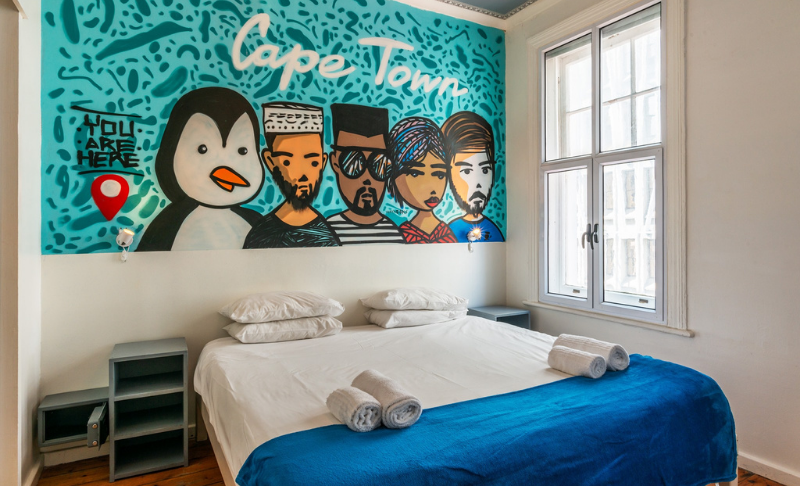
The image size is (800, 486). In order to click on sheet in this screenshot , I will do `click(461, 349)`.